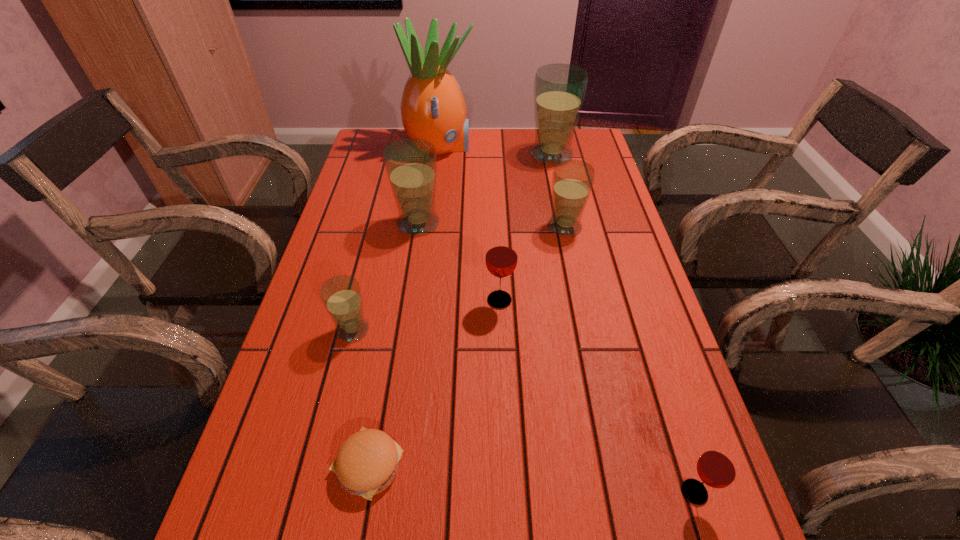
In order to click on free space between the third biggest blue glass and the patty in this screenshot , I will do `click(467, 346)`.

Where is `vacant region between the third biggest blue glass and the fifth shortest glass`? vacant region between the third biggest blue glass and the fifth shortest glass is located at coordinates (492, 225).

The image size is (960, 540). I want to click on vacant area that lies between the third smallest blue glass and the second smallest blue glass, so click(492, 225).

I want to click on the seventh closest object to the seventh shortest object, so click(718, 467).

What are the coordinates of `object that stands as the fifth closest to the fourth farthest glass` in the screenshot? It's located at (718, 467).

Where is `the closest glass relative to the rightmost object`? The image size is (960, 540). the closest glass relative to the rightmost object is located at coordinates (501, 258).

Identify which glass is the fifth closest to the fifth farthest object. Please provide its 2D coordinates. Your answer should be formatted as a tuple, i.e. [(x, y)], where the tuple contains the x and y coordinates of a point satisfying the conditions above.

[(559, 89)]

Identify the location of blue glass that can be found as the third closest to the patty. (572, 180).

What are the coordinates of `blue glass that is the nearest to the pineapple` in the screenshot? It's located at (559, 89).

Identify the location of vacant point that satisfies the following two spatial constraints: 1. on the front side of the second smallest blue glass; 2. on the left side of the fifth shortest glass. pos(418,226).